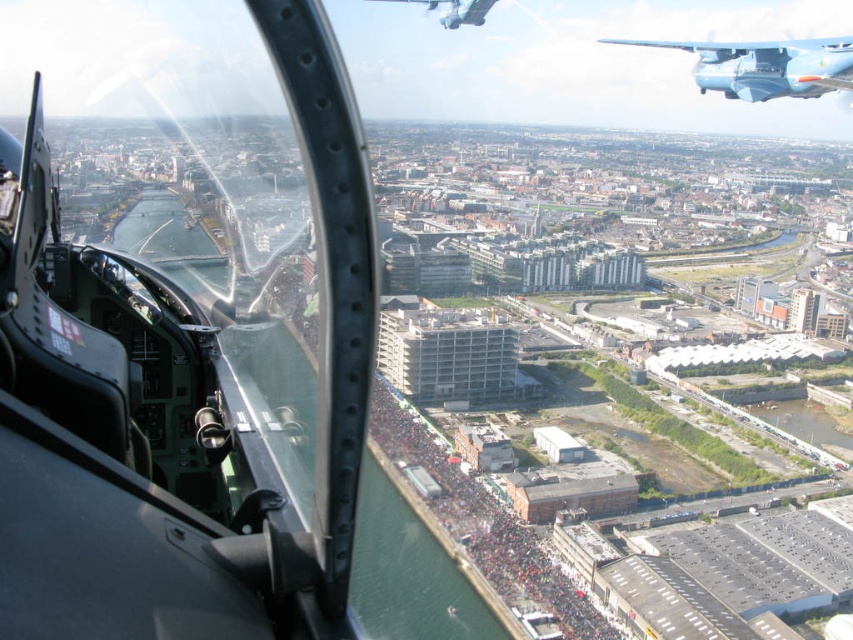
You are a pilot in the helicopter and you notice two metallic blue airplanes at the upper right corner of the canopy. Which one is closer to you, the blue metallic airplane at upper right or the metallic blue airplane at upper right?

The blue metallic airplane at upper right is closer to you because it is located below the metallic blue airplane at upper right, which means it is positioned in front of the other airplane from your perspective.

You are inside the helicopter cockpit and looking through the canopy. You notice two points outside the helicopter at coordinates point (842, 72) and point (459, 0). Which point is closer to the helicopter canopy?

Point (842, 72) is closer to the camera than point (459, 0), so the point (842, 72) is closer to the helicopter canopy.